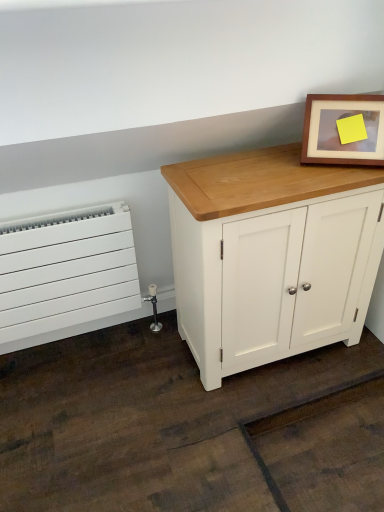
Locate an element on the screen. Image resolution: width=384 pixels, height=512 pixels. free space in front of white matte radiator at left is located at coordinates (77, 410).